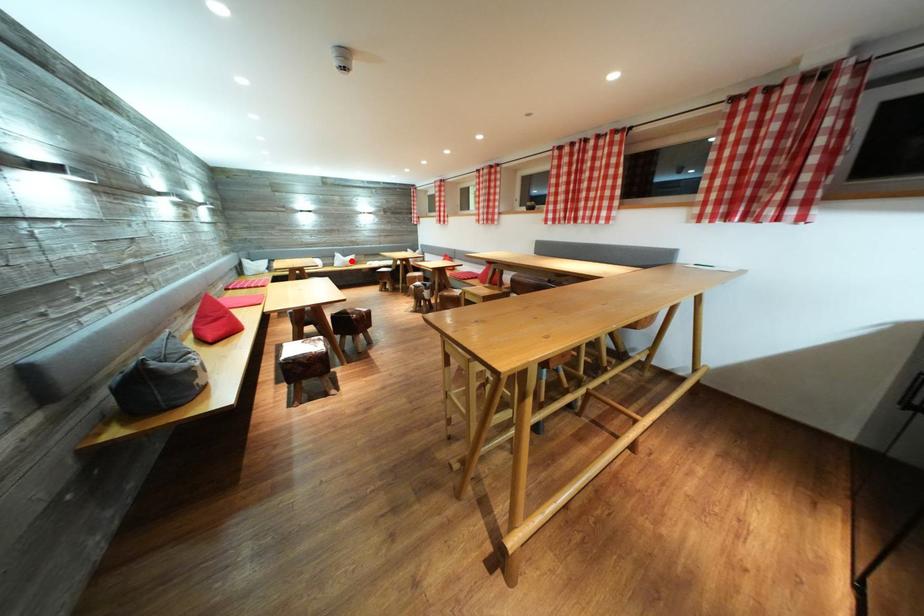
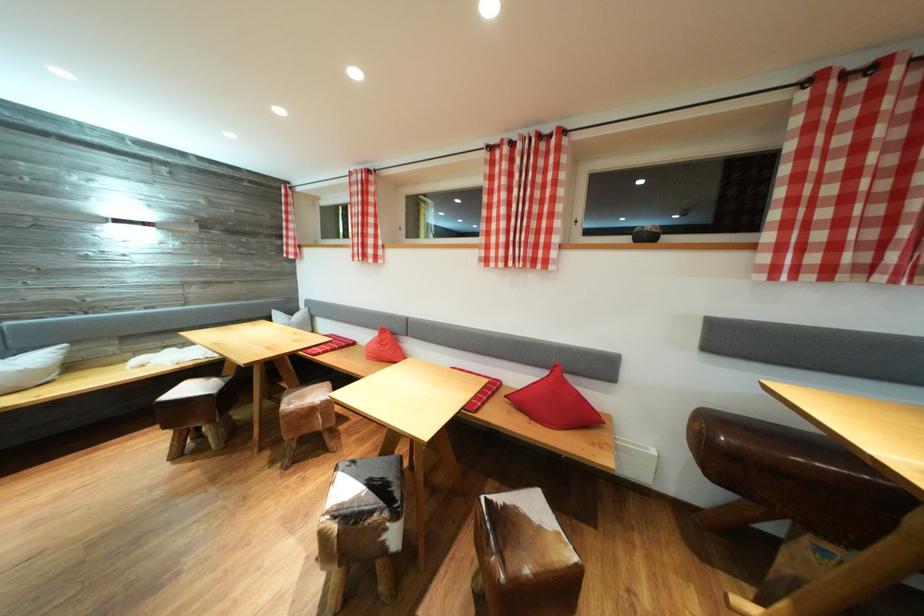
Where in the second image is the point corresponding to the highlighted location from the first image?

(14, 358)